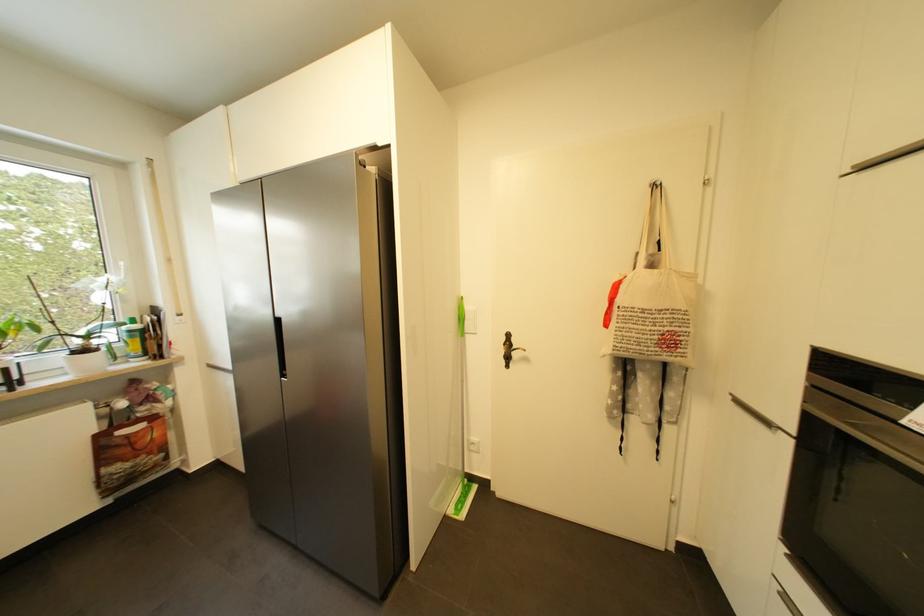
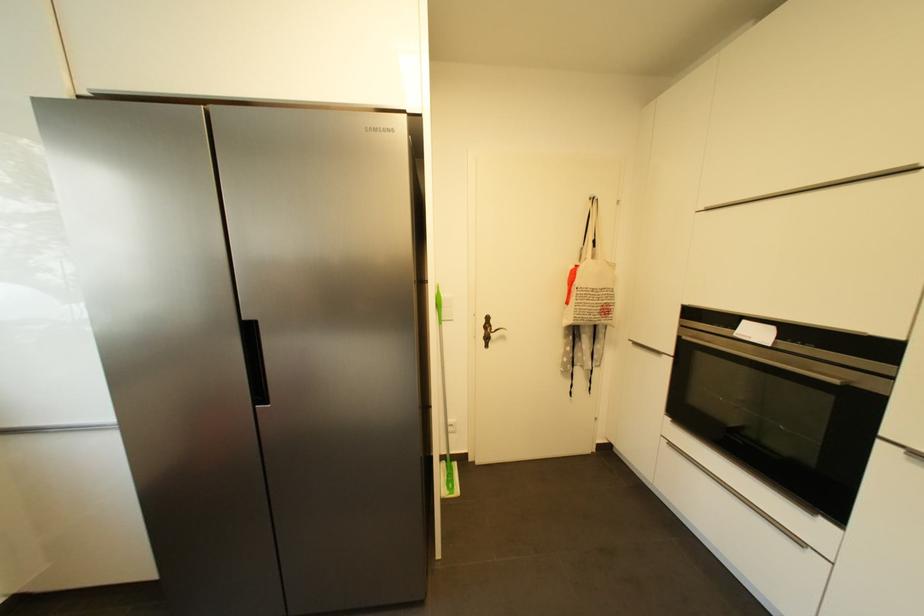
Question: How did the camera likely rotate?

Choices:
 (A) Left
 (B) Right
 (C) Up
 (D) Down

Answer: (B)